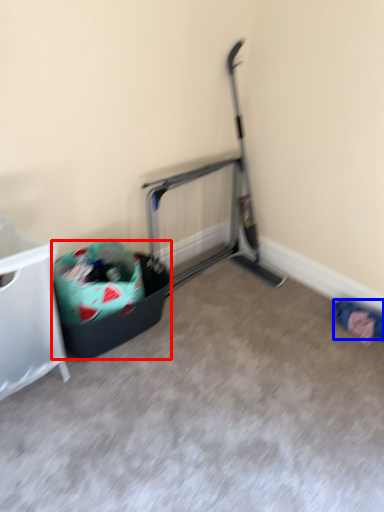
Question: Among these objects, which one is farthest to the camera, recycling bin (highlighted by a red box) or clothing (highlighted by a blue box)?

Choices:
 (A) recycling bin
 (B) clothing

Answer: (B)